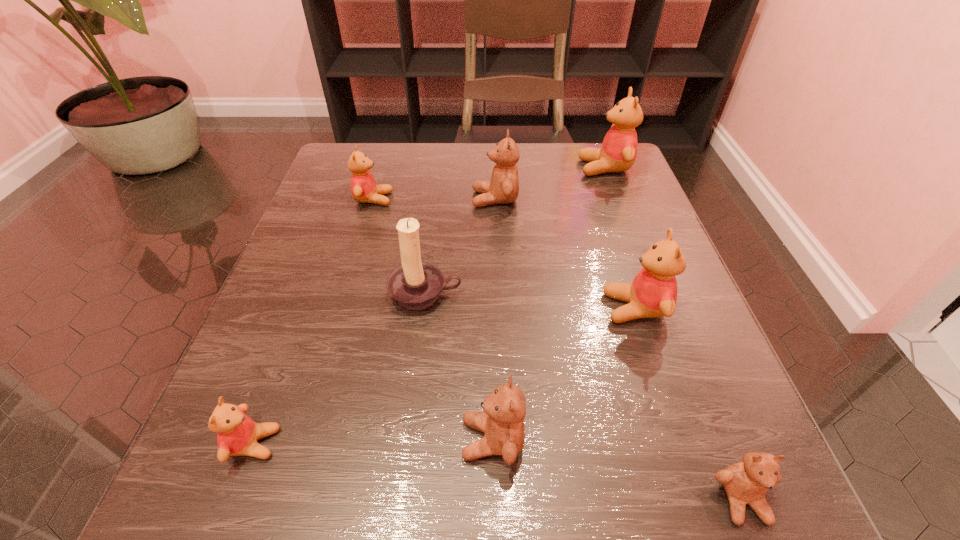
Find the location of a particular element. This screenshot has width=960, height=540. free space located on the front-facing side of the third smallest red teddy bear is located at coordinates (540, 308).

The image size is (960, 540). I want to click on free space located 0.270m on the front-facing side of the third biggest red teddy bear, so click(x=517, y=199).

Identify the location of free space located 0.240m on the face of the second smallest brown teddy bear. (277, 439).

Where is `vacant position located on the face of the second smallest brown teddy bear`? This screenshot has width=960, height=540. vacant position located on the face of the second smallest brown teddy bear is located at coordinates (224, 439).

Where is `vacant region located 0.170m on the face of the second smallest brown teddy bear`? vacant region located 0.170m on the face of the second smallest brown teddy bear is located at coordinates (331, 439).

Where is `free space located 0.190m on the front-facing side of the smallest red teddy bear`? This screenshot has width=960, height=540. free space located 0.190m on the front-facing side of the smallest red teddy bear is located at coordinates (424, 443).

In order to click on object located in the far left corner section of the desktop in this screenshot , I will do `click(363, 186)`.

Image resolution: width=960 pixels, height=540 pixels. Find the location of `object at the near left corner`. object at the near left corner is located at coordinates [x=237, y=434].

Find the location of a particular element. The width and height of the screenshot is (960, 540). object at the far right corner is located at coordinates (618, 152).

In order to click on object located at the near right corner in this screenshot , I will do `click(747, 482)`.